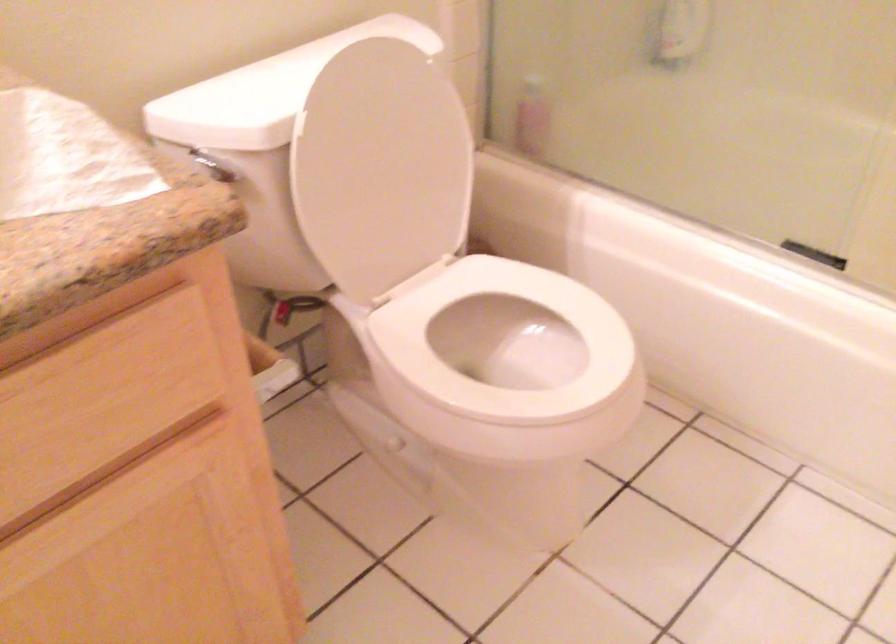
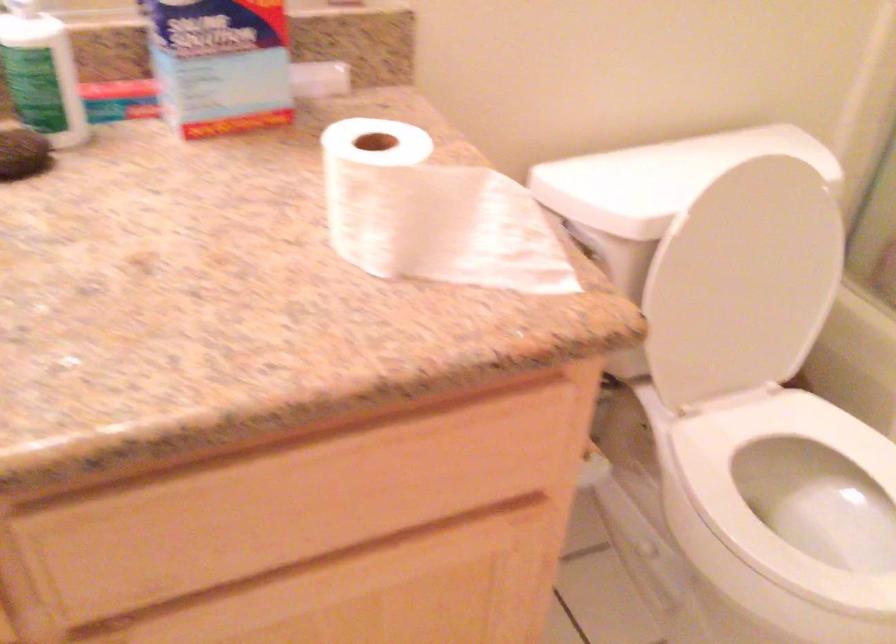
Question: The camera is either moving clockwise (left) or counter-clockwise (right) around the object. The first image is from the beginning of the video and the second image is from the end. Is the camera moving left or right when shooting the video?

Choices:
 (A) Left
 (B) Right

Answer: (B)